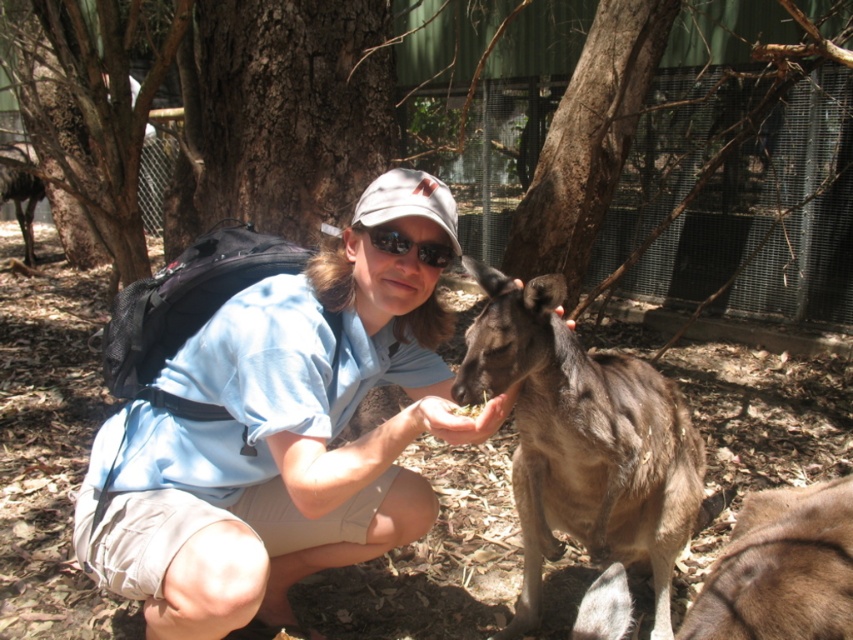
You are a photographer standing 5 feet away from the camera. You want to take a photo of the blue fabric shirt at center. Is the camera close enough to capture the shirt in focus?

The blue fabric shirt at center and camera are 5.61 feet apart from each other. Since you are standing 5 feet away from the camera, the total distance between you and the shirt would be 10.61 feet. However, the camera can typically focus up to 20 feet, so it should be able to capture the shirt in focus.

You are a photographer trying to capture a closeup of the person feeding the kangaroo. You notice the blue fabric shirt at center and the black reflective sunglasses at center. Which object is positioned more to the left side of the scene?

The blue fabric shirt at center is positioned to the left of the black reflective sunglasses at center, so the blue fabric shirt at center is more to the left side of the scene.